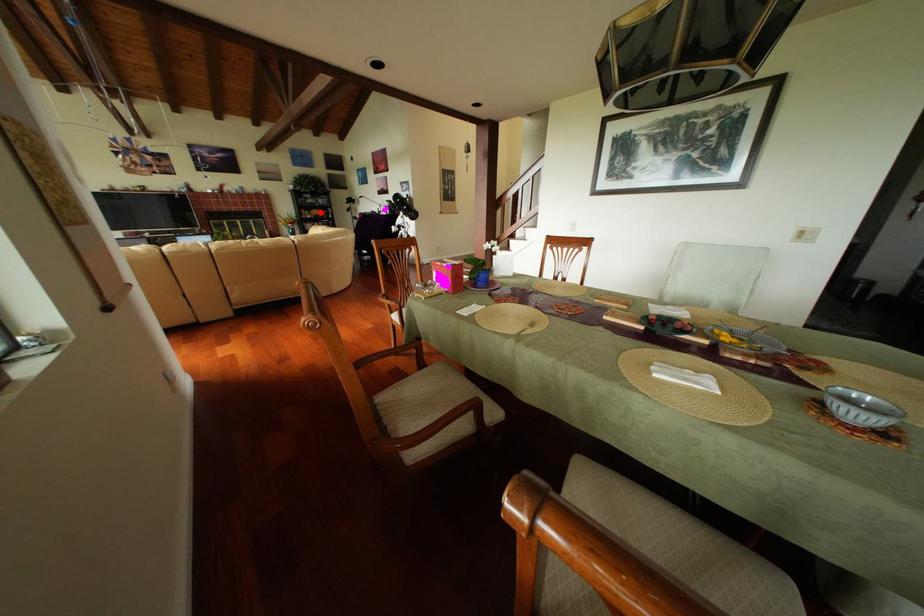
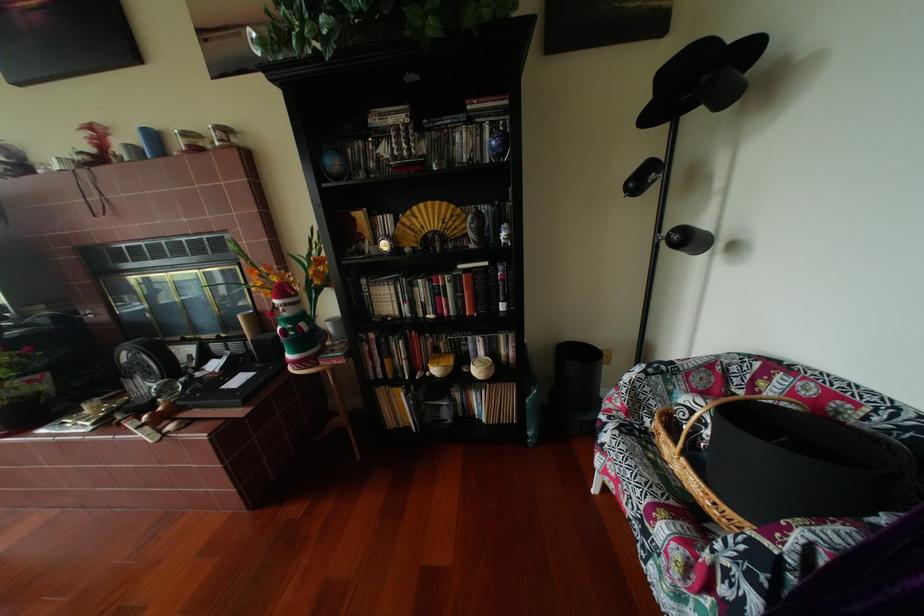
Locate, in the second image, the point that corresponds to the highlighted location in the first image.

(402, 219)